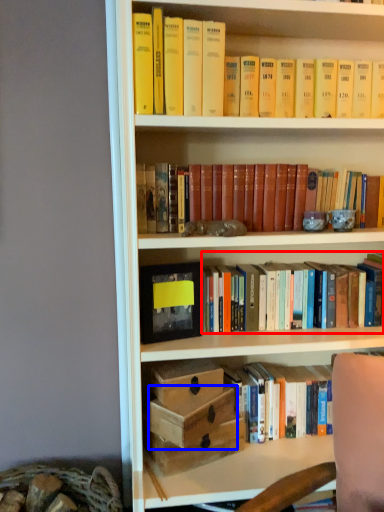
Question: Which of the following is the closest to the observer, book (highlighted by a red box) or box (highlighted by a blue box)?

Choices:
 (A) book
 (B) box

Answer: (B)